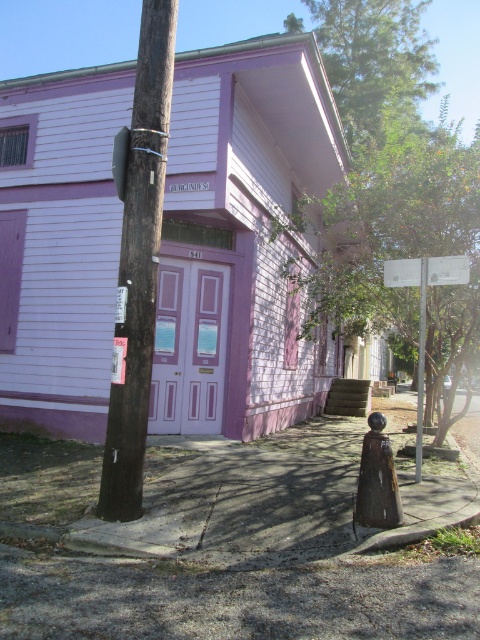
This screenshot has width=480, height=640. What do you see at coordinates (376, 480) in the screenshot?
I see `brown matte hydrant at lower right` at bounding box center [376, 480].

Does brown matte hydrant at lower right appear under metallic silver sign at center?

Yes.

Describe the element at coordinates (376, 480) in the screenshot. This screenshot has height=640, width=480. I see `brown matte hydrant at lower right` at that location.

The width and height of the screenshot is (480, 640). Identify the location of brown matte hydrant at lower right. (376, 480).

Does point (382, 192) come behind point (457, 284)?

That is True.

Does point (448, 408) come closer to viewer compared to point (455, 276)?

No, (448, 408) is behind (455, 276).

Locate an element on the screen. Image resolution: width=480 pixels, height=640 pixels. green leafy tree at center is located at coordinates (405, 241).

Locate an element on the screen. green leafy tree at center is located at coordinates [x=405, y=241].

Does brown wooden telegraph pole at left have a larger size compared to brown matte hydrant at lower right?

Actually, brown wooden telegraph pole at left might be smaller than brown matte hydrant at lower right.

Can you confirm if brown wooden telegraph pole at left is taller than brown matte hydrant at lower right?

Incorrect, brown wooden telegraph pole at left's height is not larger of brown matte hydrant at lower right's.

Who is more distant from viewer, (109, 509) or (372, 500)?

Positioned behind is point (372, 500).

The width and height of the screenshot is (480, 640). Find the location of `brown wooden telegraph pole at left`. brown wooden telegraph pole at left is located at coordinates (139, 266).